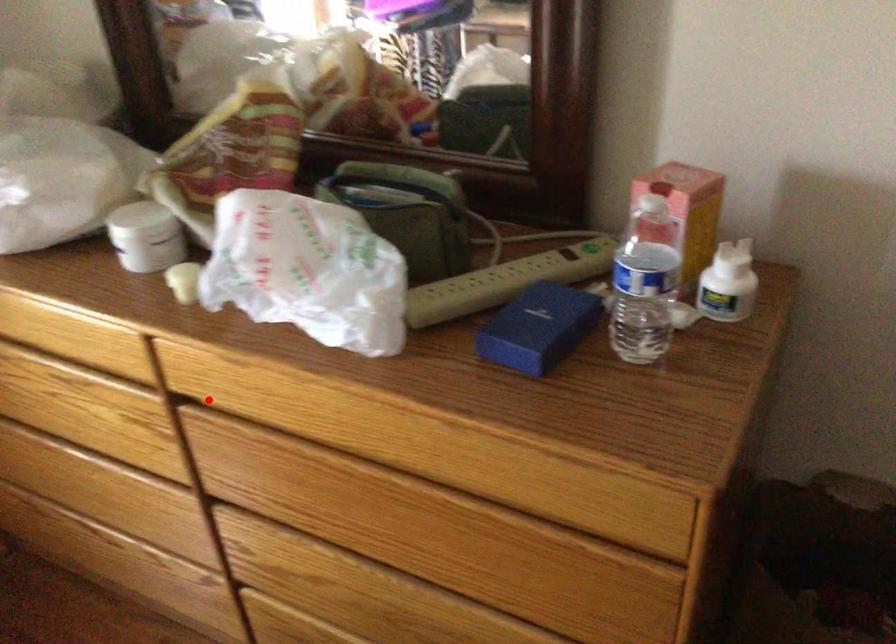
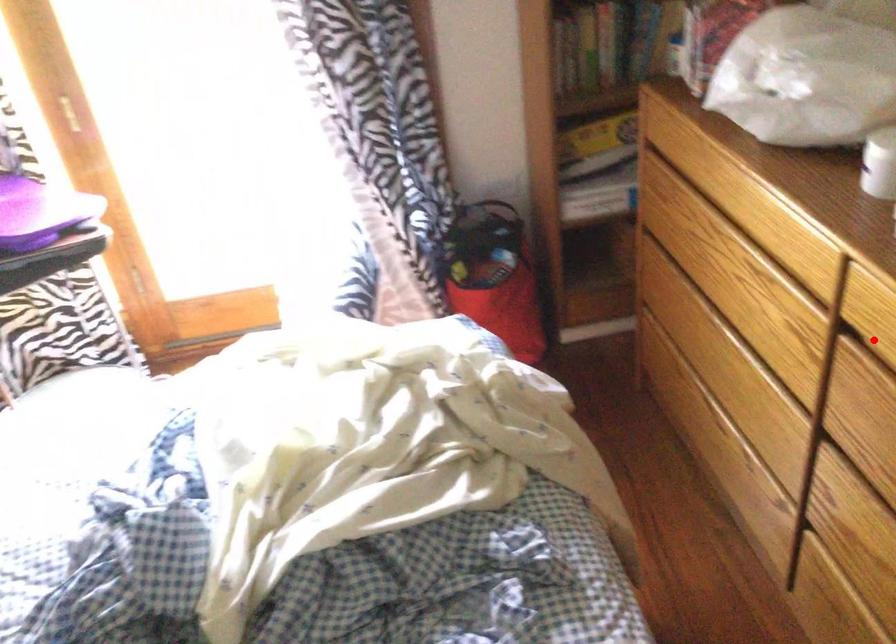
I am providing you with two images of the same scene from different viewpoints. A red point is marked on the first image and another point is marked on the second image. Are the points marked in image1 and image2 representing the same 3D position?

Yes